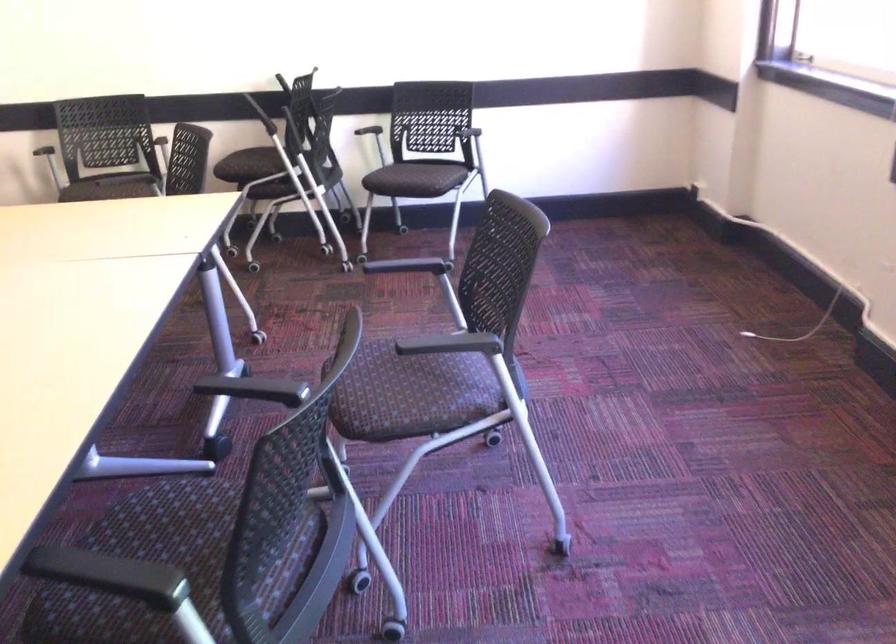
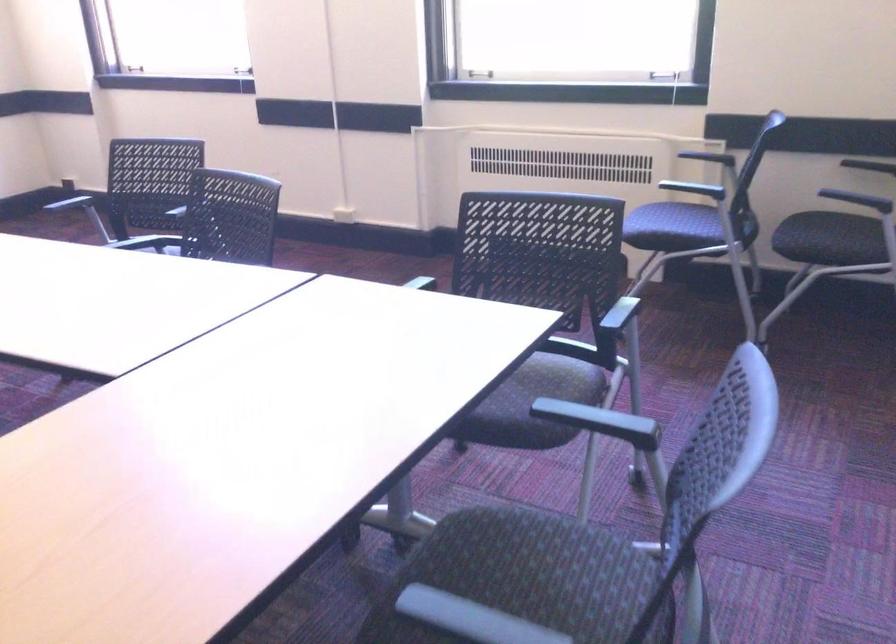
Question: I am providing you with two images of the same scene from different viewpoints. Please identify which objects are invisible in image2.

Choices:
 (A) blue chair surface
 (B) chair sitting surface
 (C) flush plate button
 (D) dark chair surface

Answer: (B)